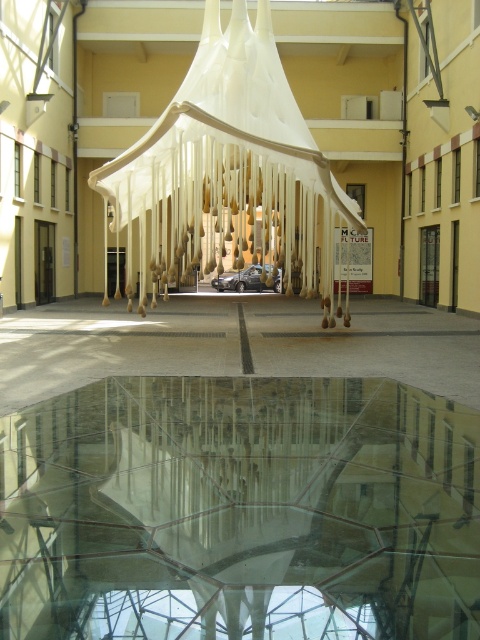
Can you confirm if transparent glass table at center is bigger than white fabric canopy bed at center?

No, transparent glass table at center is not bigger than white fabric canopy bed at center.

Is transparent glass table at center to the left of white fabric canopy bed at center from the viewer's perspective?

No, transparent glass table at center is not to the left of white fabric canopy bed at center.

Which is behind, point (57, 572) or point (169, 163)?

The point (169, 163) is more distant.

Identify the location of transparent glass table at center. (240, 512).